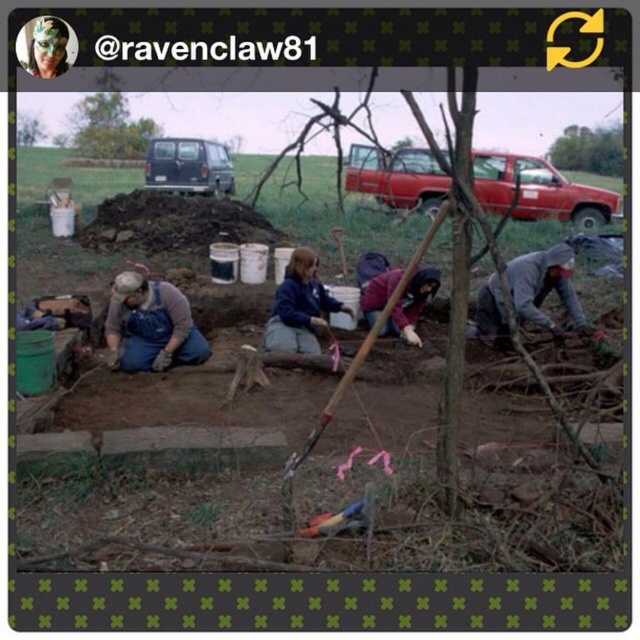
Question: Is blue denim overalls at lower left smaller than gray matte jacket at lower right?

Choices:
 (A) no
 (B) yes

Answer: (B)

Question: Can you confirm if brown wood tree at upper left is smaller than blue fleece jacket at center?

Choices:
 (A) yes
 (B) no

Answer: (B)

Question: Is brown wood tree at upper left to the right of green matte mask at upper left from the viewer's perspective?

Choices:
 (A) yes
 (B) no

Answer: (B)

Question: Among these objects, which one is farthest from the camera?

Choices:
 (A) gray matte jacket at lower right
 (B) brown wood tree at upper left
 (C) blue fleece jacket at center

Answer: (B)

Question: Which point is closer to the camera?

Choices:
 (A) (180, 349)
 (B) (317, 321)
 (C) (428, 278)

Answer: (A)

Question: Which object is positioned farthest from the blue fleece jacket at center?

Choices:
 (A) green leafy tree at upper center
 (B) brown wood tree at upper left
 (C) gray matte jacket at lower right

Answer: (A)